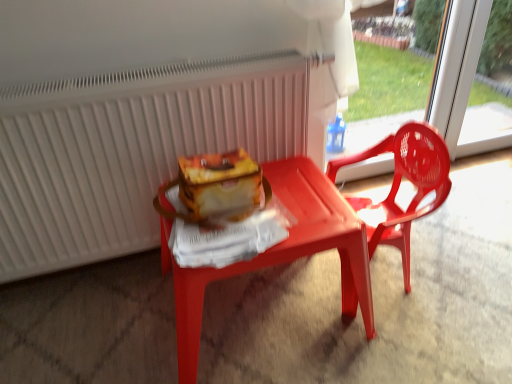
The height and width of the screenshot is (384, 512). I want to click on vacant area on top of matte plastic table at center (from a real-world perspective), so click(272, 207).